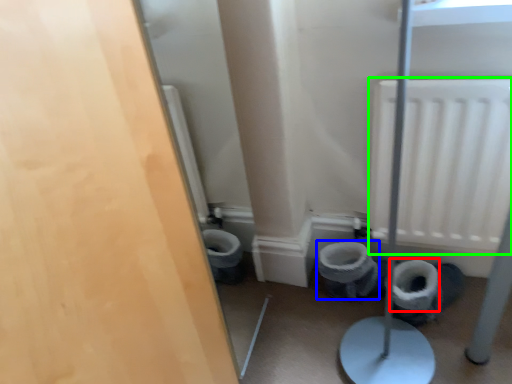
Question: Estimate the real-world distances between objects in this image. Which object is closer to toilet paper (highlighted by a red box), toilet bowl (highlighted by a blue box) or radiator (highlighted by a green box)?

Choices:
 (A) toilet bowl
 (B) radiator

Answer: (A)